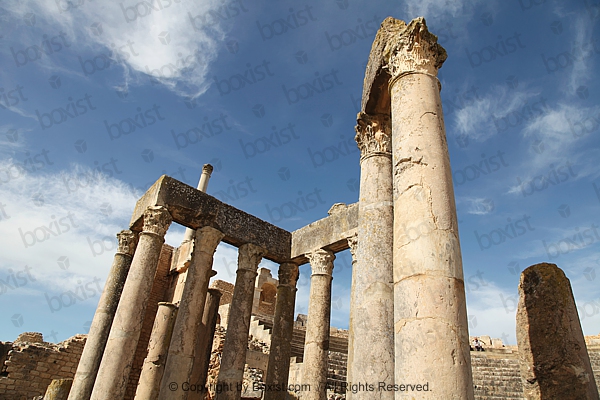
Locate an element on the screen. Image resolution: width=600 pixels, height=400 pixels. pillar is located at coordinates (358, 352).